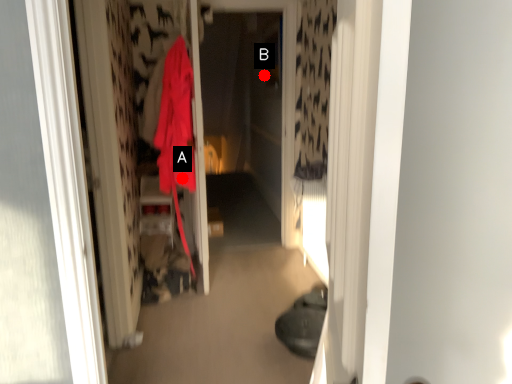
Question: Two points are circled on the image, labeled by A and B beside each circle. Which point is closer to the camera?

Choices:
 (A) A is closer
 (B) B is closer

Answer: (A)